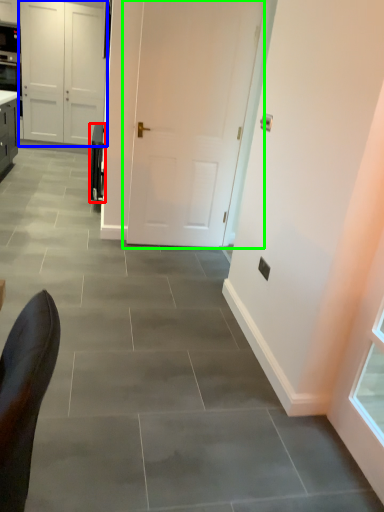
Question: Considering the real-world distances, which object is closest to appliance (highlighted by a red box)? door (highlighted by a blue box) or door (highlighted by a green box).

Choices:
 (A) door
 (B) door

Answer: (B)